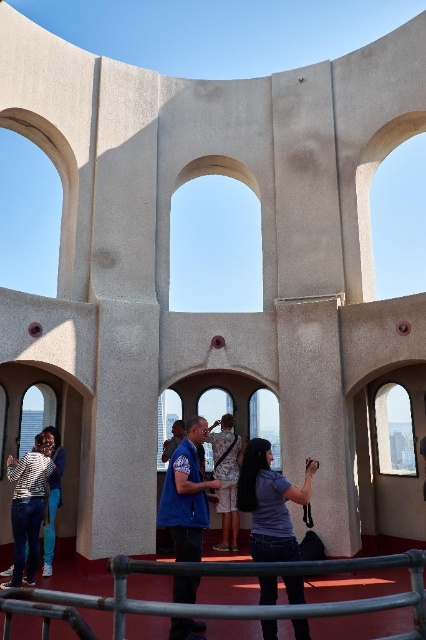
You are standing at the entrance of the circular structure and want to take a photo of the matte blue shirt at center without including the metallic gray railing at lower center in the frame. Is this possible?

The metallic gray railing at lower center is in front of the matte blue shirt at center, so it would block the view. To avoid including the metallic gray railing at lower center, you would need to move to a position where the railing is not between you and the matte blue shirt at center.